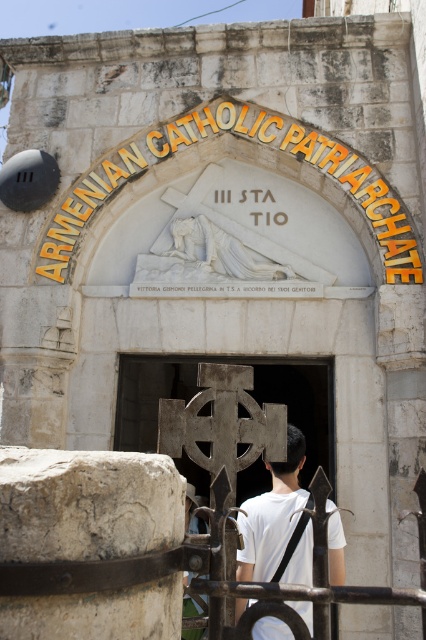
You are an architect visiting the Armenian Catholic Patriarchate. You notice the white stone relief at upper center and the white matte shirt at center. Which object takes up more visual space in the scene?

The white matte shirt at center takes up more visual space than the white stone relief at upper center because the description states that the white stone relief at upper center occupies less space than the white matte shirt at center.

You are standing at the entrance of the Armenian Catholic Patriarchate and want to take a photo. There are two points marked in the image, point 1 at coordinates point (412, 237) and point 2 at coordinates point (270, 497). If you want to focus on the point that is closer to you, which point should you choose?

Point (270, 497) is closer to the camera than point (412, 237), so you should choose point (270, 497) to focus on the point that is closer to you.

You are standing at the entrance of the Armenian Catholic Patriarchate and want to locate the white stone relief at upper center. Based on the coordinates provided, can you determine its position relative to the entrance?

The white stone relief at upper center is positioned at coordinates 0.217 on the x axis and 0.580 on the y axis, meaning it is located slightly to the left and above the central point of the entrance structure.